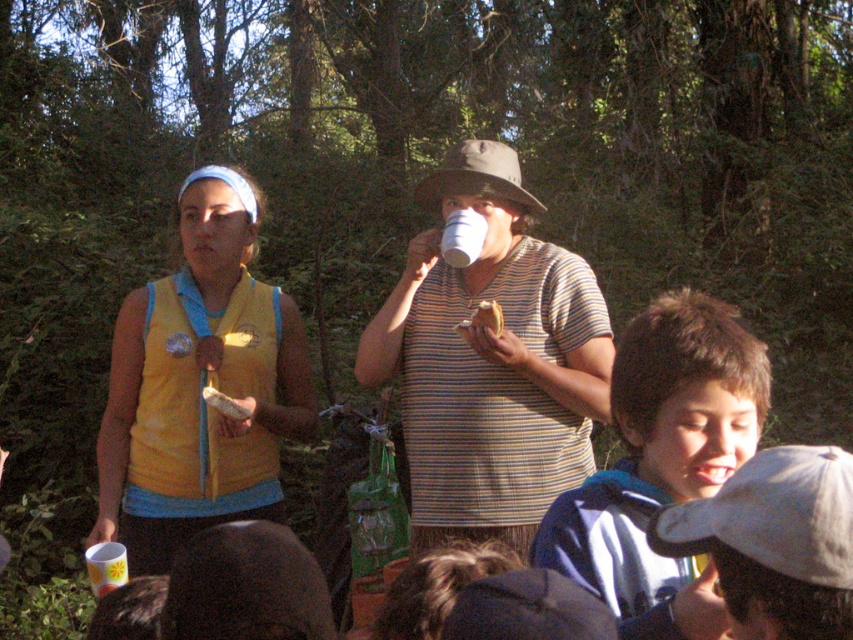
Question: Which object appears farthest from the camera in this image?

Choices:
 (A) striped cotton shirt at center
 (B) blue fleece jacket at center

Answer: (A)

Question: Is striped cotton shirt at center smaller than yellow fabric vest at left?

Choices:
 (A) yes
 (B) no

Answer: (B)

Question: Does yellow fabric vest at left appear on the left side of blue fleece jacket at center?

Choices:
 (A) yes
 (B) no

Answer: (A)

Question: Which object is the closest to the white matte cup at center?

Choices:
 (A) yellow fabric vest at left
 (B) blue fleece jacket at center

Answer: (A)

Question: Which object is closer to the camera taking this photo?

Choices:
 (A) striped cotton shirt at center
 (B) yellow fabric vest at left
 (C) white matte cup at center

Answer: (A)

Question: Is striped cotton shirt at center thinner than yellow fabric vest at left?

Choices:
 (A) yes
 (B) no

Answer: (B)